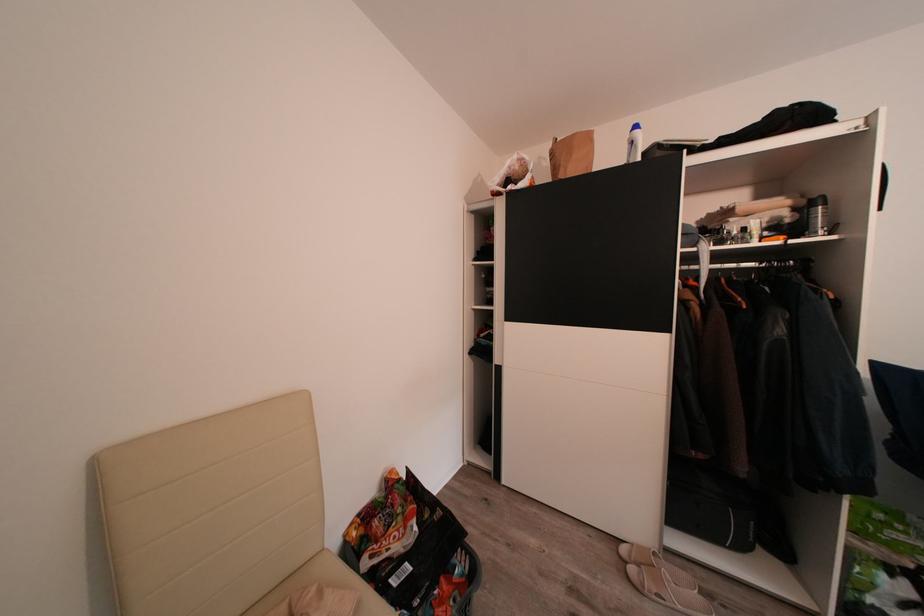
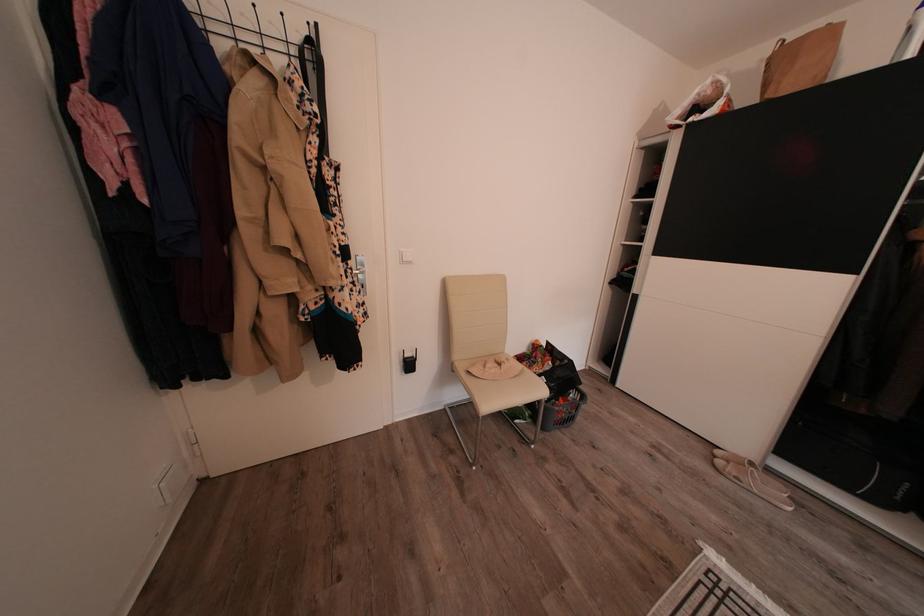
Locate, in the second image, the point that corresponds to [446,589] in the first image.

(565, 405)